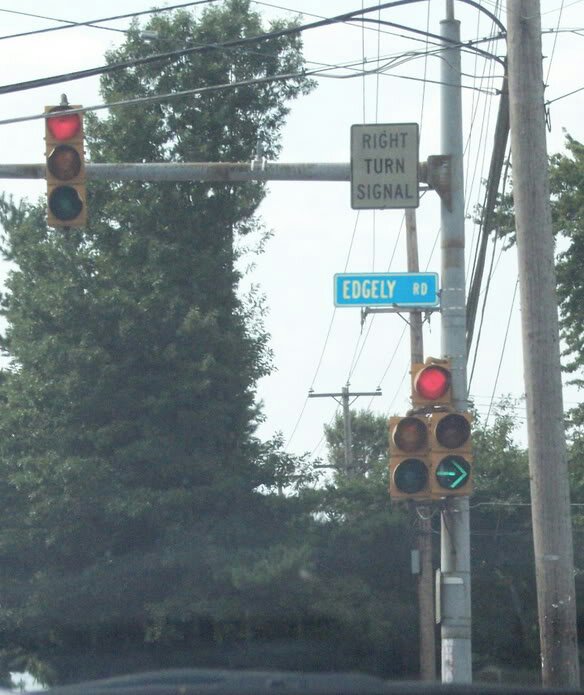
You are a GUI agent. You are given a task and a screenshot of the screen. Output one action in this format:
    pyautogui.click(x=<x>, y=<y>)
    Task: Click on the "red lights" turned on
    This screenshot has height=695, width=584.
    Given the screenshot: What is the action you would take?
    pyautogui.click(x=430, y=379), pyautogui.click(x=69, y=129)